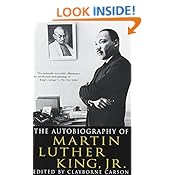
Find the location of a particular element. light colored photo frame is located at coordinates (75, 39).